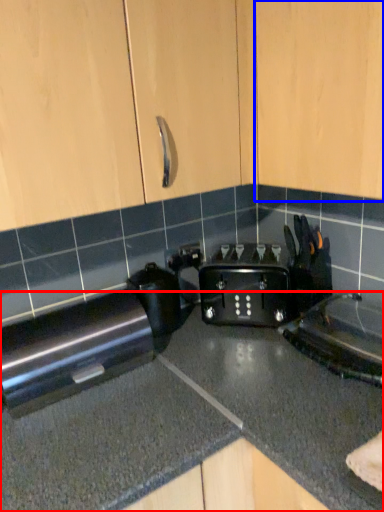
Question: Among these objects, which one is farthest to the camera, countertop (highlighted by a red box) or cabinetry (highlighted by a blue box)?

Choices:
 (A) countertop
 (B) cabinetry

Answer: (B)